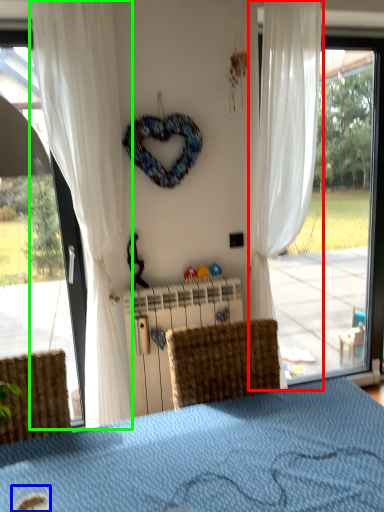
Question: Which is farther away from curtain (highlighted by a red box)? beverage (highlighted by a blue box) or curtain (highlighted by a green box)?

Choices:
 (A) beverage
 (B) curtain

Answer: (A)